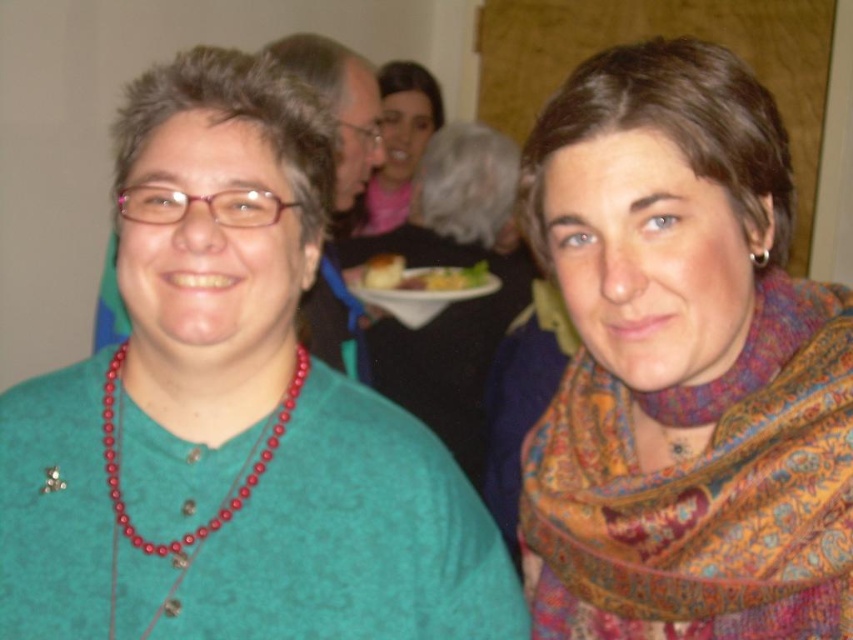
Question: Which point is farther from the camera taking this photo?

Choices:
 (A) (503, 230)
 (B) (395, 280)
 (C) (434, 298)

Answer: (A)

Question: Is white matte plate at center smaller than white glossy plate at center?

Choices:
 (A) no
 (B) yes

Answer: (A)

Question: Does multicolored scarf at center appear under matte red beaded necklace at center?

Choices:
 (A) no
 (B) yes

Answer: (A)

Question: Which point is closer to the camera?

Choices:
 (A) matte red beaded necklace at center
 (B) multicolored scarf at center

Answer: (A)

Question: Can you confirm if multicolored scarf at center is thinner than matte pink scarf at upper center?

Choices:
 (A) no
 (B) yes

Answer: (A)

Question: Estimate the real-world distances between objects in this image. Which object is closer to the yellow cake at center?

Choices:
 (A) matte red beaded necklace at center
 (B) multicolored scarf at center

Answer: (B)